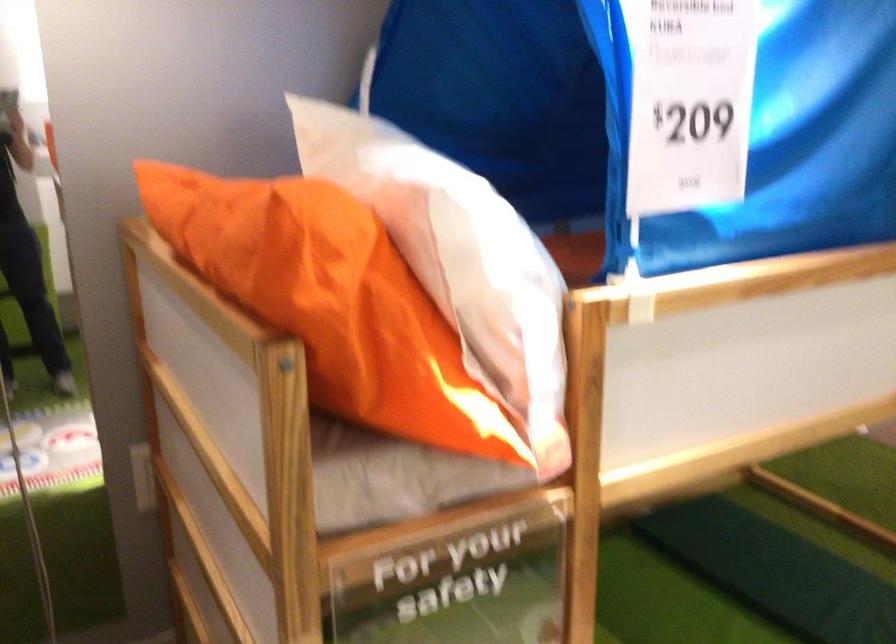
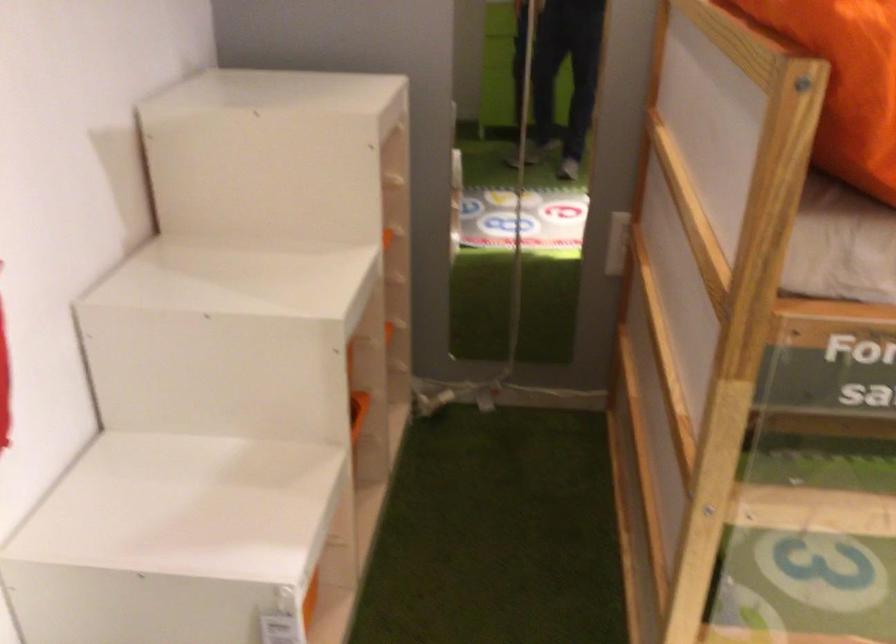
The point at (x=322, y=355) is marked in the first image. Where is the corresponding point in the second image?

(846, 82)